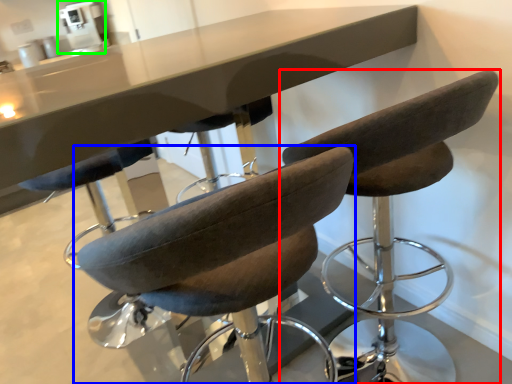
Question: Which object is positioned farthest from chair (highlighted by a red box)? Select from chair (highlighted by a blue box) and coffee machine (highlighted by a green box).

Choices:
 (A) chair
 (B) coffee machine

Answer: (B)